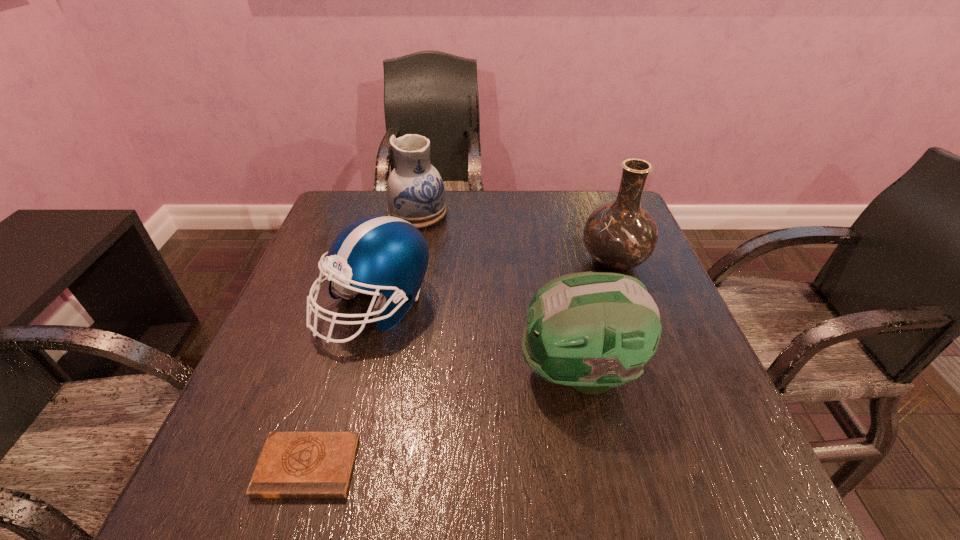
Where is `free spot between the diary and the left football helmet`? free spot between the diary and the left football helmet is located at coordinates (342, 386).

This screenshot has height=540, width=960. Identify the location of vacant space that is in between the farthest object and the diary. (362, 339).

Where is `vacant region between the right football helmet and the pottery`? vacant region between the right football helmet and the pottery is located at coordinates (498, 292).

Point out which object is positioned as the third nearest to the right football helmet. Please provide its 2D coordinates. Your answer should be formatted as a tuple, i.e. [(x, y)], where the tuple contains the x and y coordinates of a point satisfying the conditions above.

[(292, 464)]

You are a GUI agent. You are given a task and a screenshot of the screen. Output one action in this format:
    pyautogui.click(x=<x>, y=<y>)
    Task: Click on the object that is the second closest to the nearest object
    
    Given the screenshot: What is the action you would take?
    pyautogui.click(x=593, y=331)

Find the location of `free point that satisfies the following two spatial constraints: 1. on the visor of the right football helmet; 2. on the spine side of the nearest object`. free point that satisfies the following two spatial constraints: 1. on the visor of the right football helmet; 2. on the spine side of the nearest object is located at coordinates (598, 466).